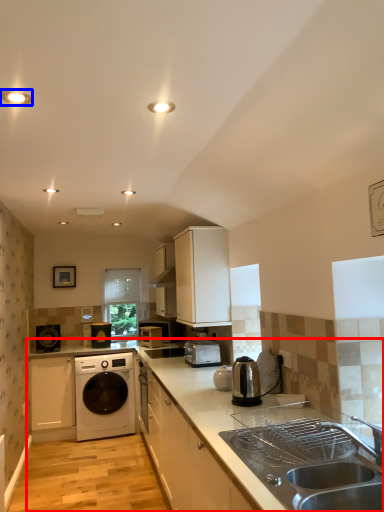
Question: Which point is further to the camera, countertop (highlighted by a red box) or lighting (highlighted by a blue box)?

Choices:
 (A) countertop
 (B) lighting

Answer: (B)